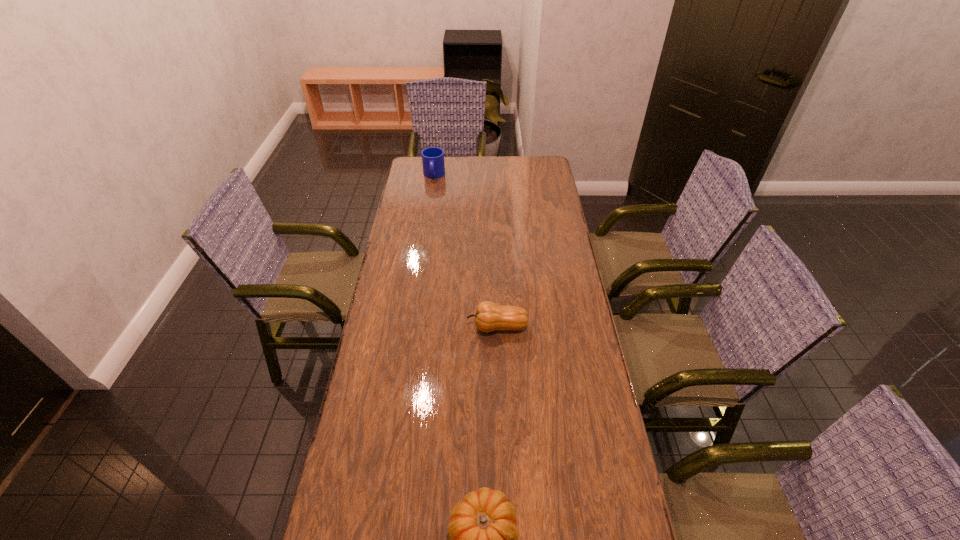
This screenshot has height=540, width=960. What are the coordinates of `free region at the far edge` in the screenshot? It's located at (449, 177).

Locate an element on the screen. This screenshot has width=960, height=540. vacant space at the left edge is located at coordinates (394, 241).

Identify the location of vacant space at the right edge. The image size is (960, 540). (566, 470).

The height and width of the screenshot is (540, 960). I want to click on vacant area at the far right corner, so click(525, 172).

Image resolution: width=960 pixels, height=540 pixels. What are the coordinates of `free spot between the farther gourd and the farthest object` in the screenshot? It's located at (466, 251).

The image size is (960, 540). I want to click on free space between the farther gourd and the farthest object, so click(466, 251).

Where is `free point between the farthest object and the farther gourd`? This screenshot has height=540, width=960. free point between the farthest object and the farther gourd is located at coordinates (466, 251).

Locate an element on the screen. the closest object relative to the nearest object is located at coordinates (489, 316).

The height and width of the screenshot is (540, 960). I want to click on the closest object to the mug, so click(489, 316).